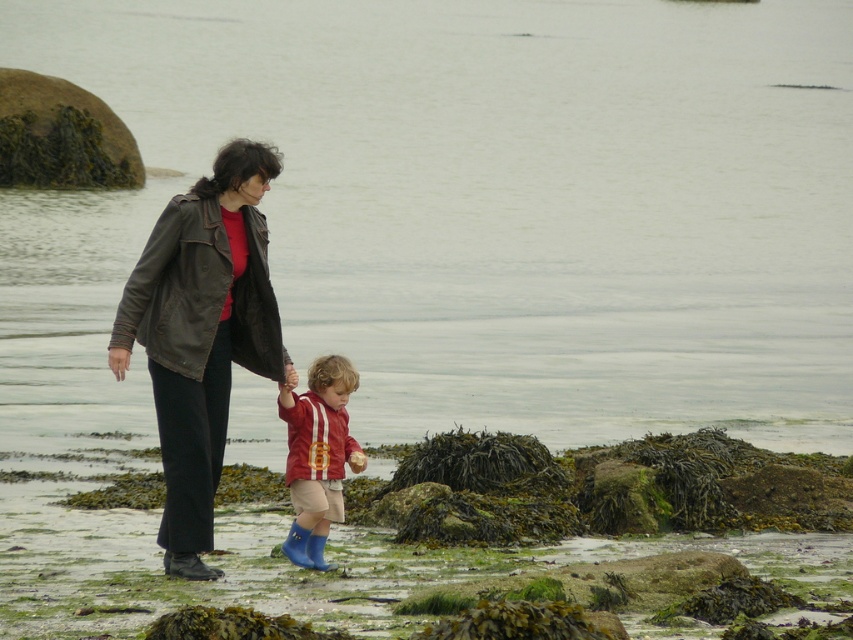
Question: Based on their relative distances, which object is farther from the rubber blue boots at center?

Choices:
 (A) leather jacket at center
 (B) clear water at center

Answer: (B)

Question: Which point is farther to the camera?

Choices:
 (A) clear water at center
 (B) leather jacket at center

Answer: (A)

Question: Where is clear water at center located in relation to leather jacket at center in the image?

Choices:
 (A) above
 (B) below

Answer: (A)

Question: Can you confirm if clear water at center is bigger than rubber blue boots at center?

Choices:
 (A) yes
 (B) no

Answer: (A)

Question: Which point is closer to the camera taking this photo?

Choices:
 (A) (311, 451)
 (B) (270, 365)

Answer: (A)

Question: Can you confirm if clear water at center is smaller than leather jacket at center?

Choices:
 (A) yes
 (B) no

Answer: (B)